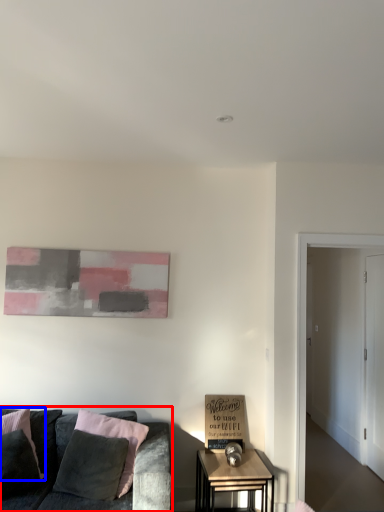
Question: Which point is closer to the camera, studio couch (highlighted by a red box) or pillow (highlighted by a blue box)?

Choices:
 (A) studio couch
 (B) pillow

Answer: (A)